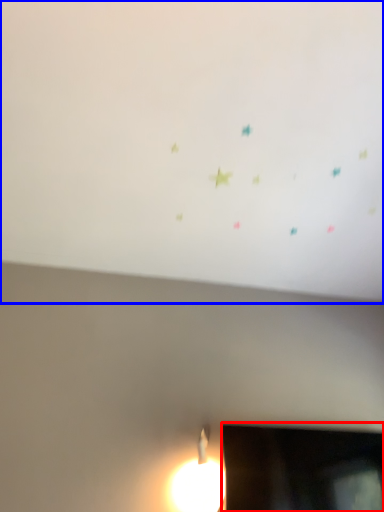
Question: Which object is further to the camera taking this photo, television (highlighted by a red box) or backdrop (highlighted by a blue box)?

Choices:
 (A) television
 (B) backdrop

Answer: (A)